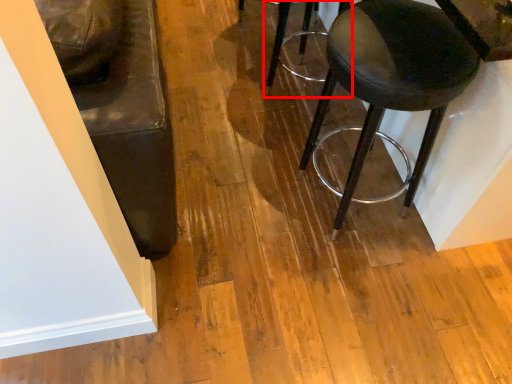
Question: From the image's perspective, where is stool (annotated by the red box) located relative to stool?

Choices:
 (A) above
 (B) below

Answer: (A)